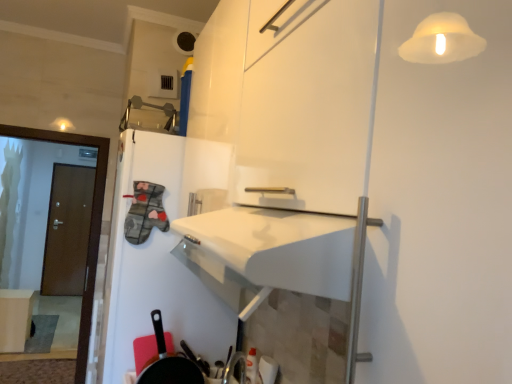
Question: Is matte white table at lower left smaller than black matte frying pan at lower left?

Choices:
 (A) no
 (B) yes

Answer: (A)

Question: Can you confirm if matte white table at lower left is wider than black matte frying pan at lower left?

Choices:
 (A) no
 (B) yes

Answer: (B)

Question: From the image's perspective, is matte white table at lower left under black matte frying pan at lower left?

Choices:
 (A) no
 (B) yes

Answer: (B)

Question: Is matte white table at lower left thinner than black matte frying pan at lower left?

Choices:
 (A) yes
 (B) no

Answer: (B)

Question: Considering the relative positions of matte white table at lower left and black matte frying pan at lower left in the image provided, is matte white table at lower left to the left of black matte frying pan at lower left from the viewer's perspective?

Choices:
 (A) no
 (B) yes

Answer: (B)

Question: Could you tell me if matte white table at lower left is facing black matte frying pan at lower left?

Choices:
 (A) yes
 (B) no

Answer: (B)

Question: Can you confirm if brown wooden door at left is positioned to the left of black matte frying pan at lower left?

Choices:
 (A) no
 (B) yes

Answer: (B)

Question: From the image's perspective, is brown wooden door at left located beneath black matte frying pan at lower left?

Choices:
 (A) yes
 (B) no

Answer: (B)

Question: Is brown wooden door at left at the right side of black matte frying pan at lower left?

Choices:
 (A) no
 (B) yes

Answer: (A)

Question: Is brown wooden door at left shorter than black matte frying pan at lower left?

Choices:
 (A) yes
 (B) no

Answer: (B)

Question: From a real-world perspective, is brown wooden door at left over black matte frying pan at lower left?

Choices:
 (A) no
 (B) yes

Answer: (B)

Question: Is brown wooden door at left not within black matte frying pan at lower left?

Choices:
 (A) yes
 (B) no

Answer: (A)

Question: Is matte white table at lower left outside brown wooden door at left?

Choices:
 (A) no
 (B) yes

Answer: (B)